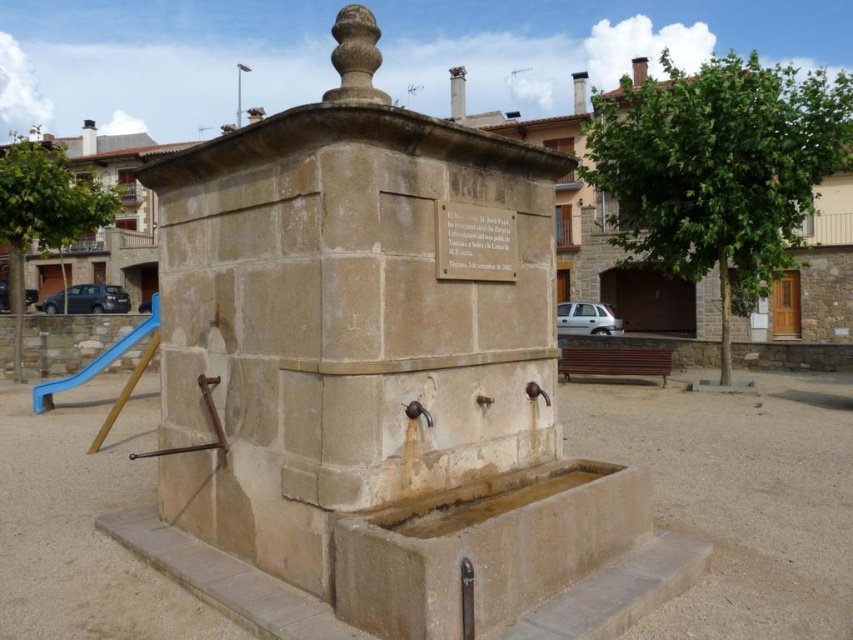
Is stone plaque at center taller than blue plastic slide at left?

Incorrect, stone plaque at center's height is not larger of blue plastic slide at left's.

Does stone plaque at center appear on the right side of blue plastic slide at left?

Indeed, stone plaque at center is positioned on the right side of blue plastic slide at left.

Does point (480, 250) come behind point (44, 406)?

No, it is not.

The image size is (853, 640). In order to click on stone plaque at center in this screenshot , I will do click(x=474, y=243).